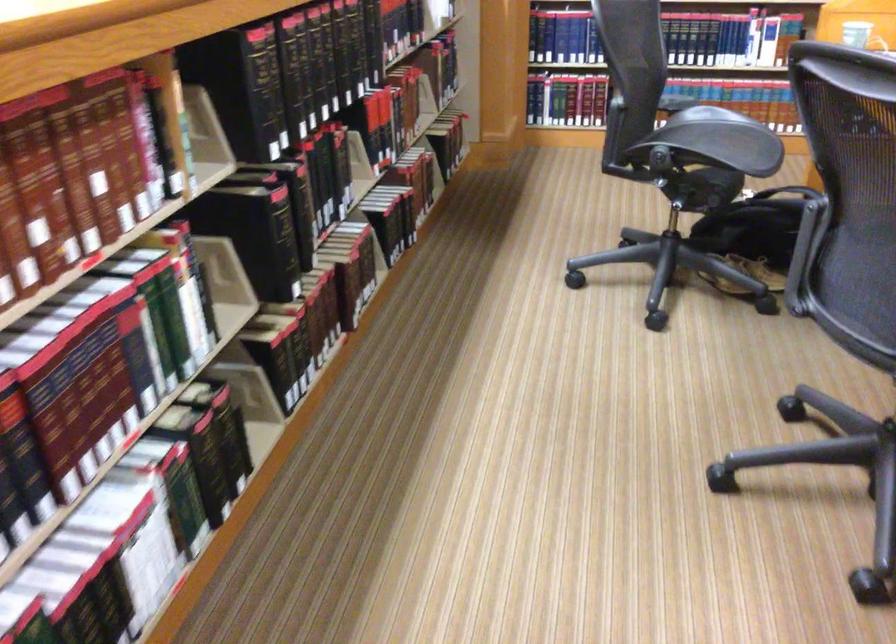
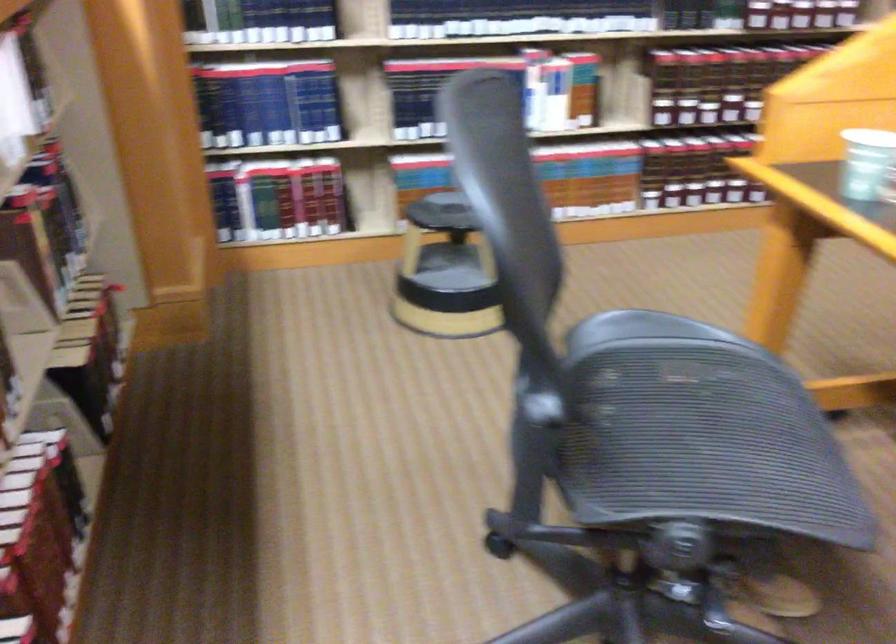
Question: What movement of the cameraman would produce the second image?

Choices:
 (A) Left
 (B) Right
 (C) Forward
 (D) Backward

Answer: (C)